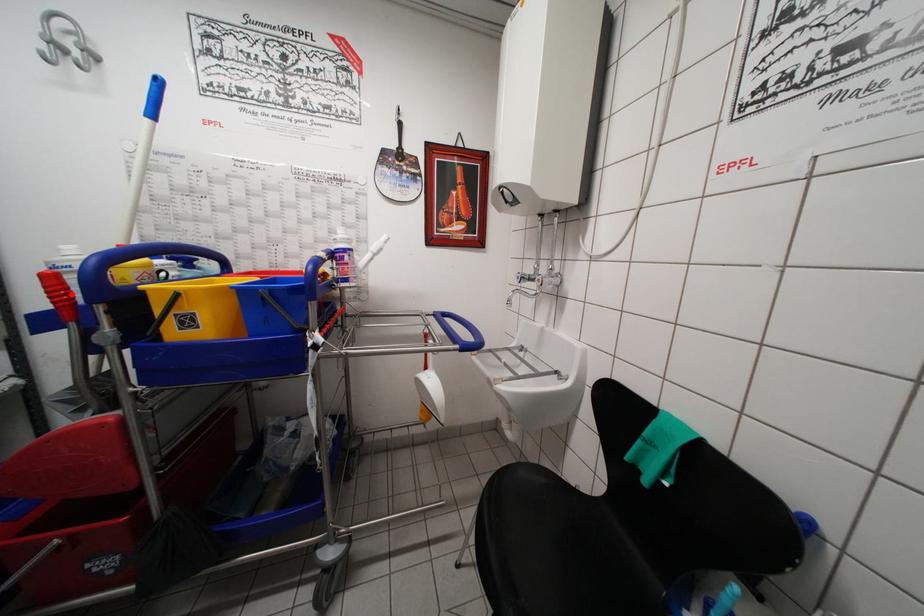
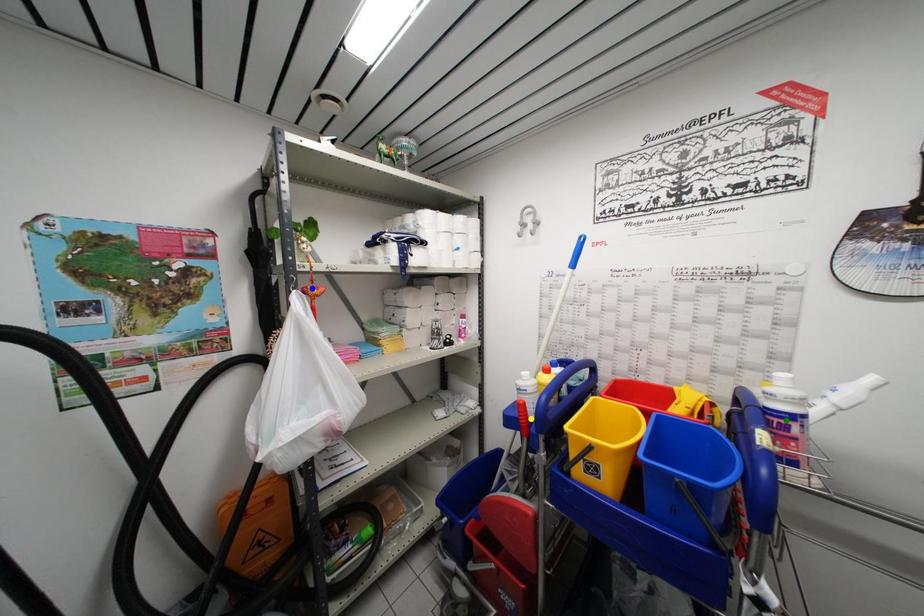
Question: I am providing you with two images of the same scene from different viewpoints. A red point is marked on the first image. You are given multiple points on the second image. Which point in image 2 is actually the same real-world point as the red point in image 1?

Choices:
 (A) blue point
 (B) green point
 (C) yellow point

Answer: (C)